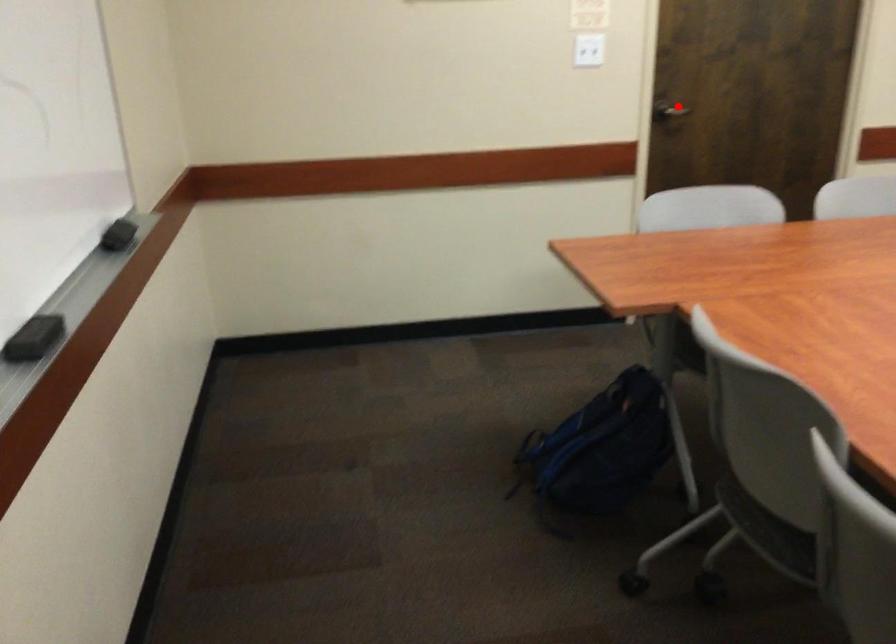
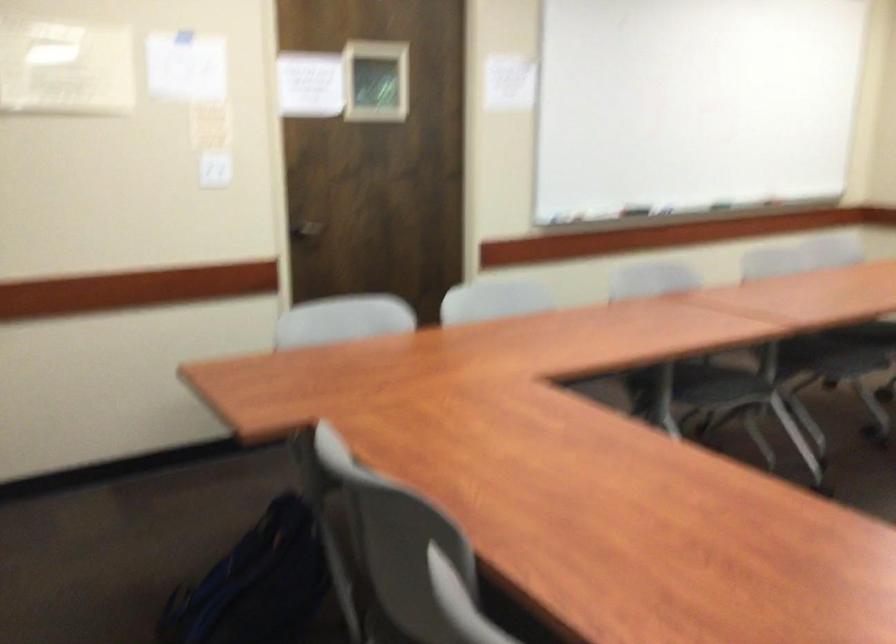
Locate, in the second image, the point that corresponds to the highlighted location in the first image.

(306, 228)